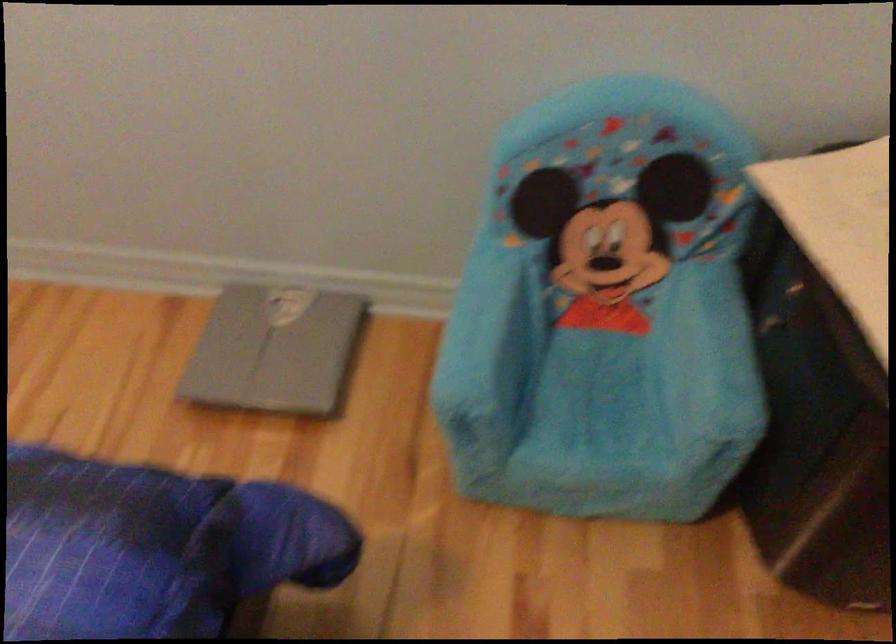
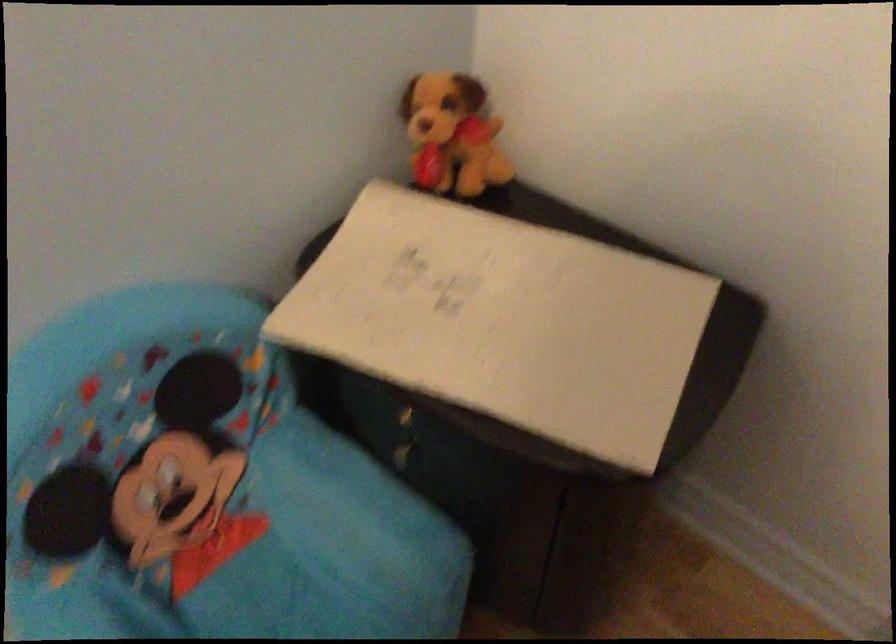
In the second image, find the point that corresponds to (776,312) in the first image.

(403, 438)